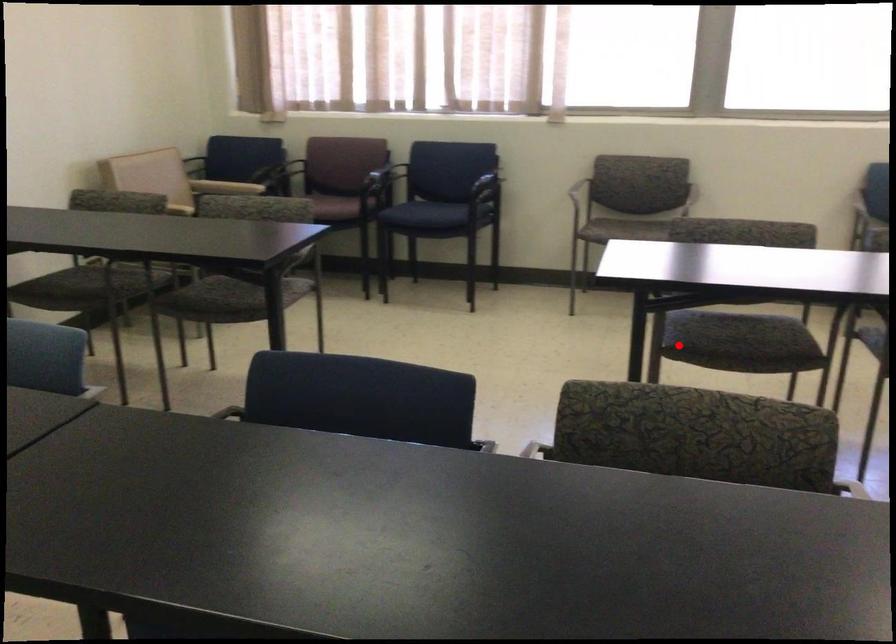
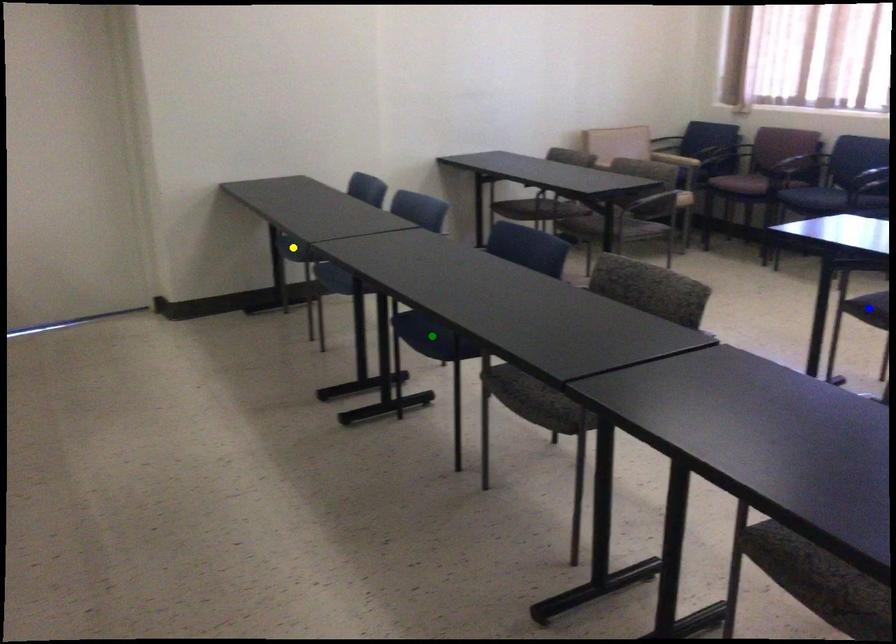
Question: I am providing you with two images of the same scene from different viewpoints. A red point is marked on the first image. You are given multiple points on the second image. Which point in image 2 represents the same 3d spot as the red point in image 1?

Choices:
 (A) blue point
 (B) green point
 (C) yellow point

Answer: (A)